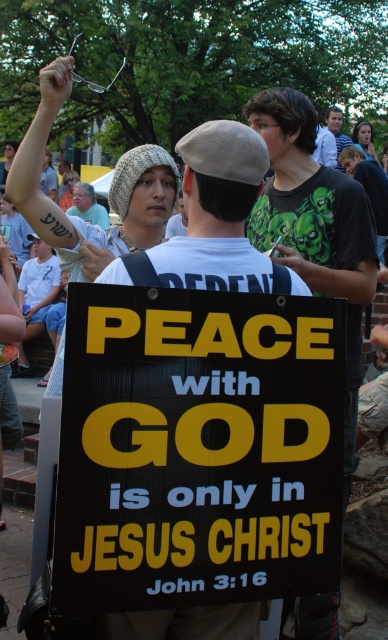
Can you confirm if beige knit hat at upper center is positioned above green t-shirt at center?

No.

Is beige knit hat at upper center wider than green t-shirt at center?

Yes, beige knit hat at upper center is wider than green t-shirt at center.

Which is in front, point (93, 220) or point (334, 132)?

Point (93, 220) is in front.

Image resolution: width=388 pixels, height=640 pixels. I want to click on beige knit hat at upper center, so click(x=88, y=205).

Can you confirm if yellow/black cardboard sign at center is thinner than beige knit hat at upper center?

Yes.

Is yellow/black cardboard sign at center below beige knit hat at upper center?

Indeed, yellow/black cardboard sign at center is positioned under beige knit hat at upper center.

Which is in front, point (154, 348) or point (83, 212)?

Point (154, 348) is more forward.

Where is `yellow/black cardboard sign at center`? yellow/black cardboard sign at center is located at coordinates (197, 449).

Between yellow/black cardboard sign at center and green t-shirt at center, which one appears on the left side from the viewer's perspective?

yellow/black cardboard sign at center

Between yellow/black cardboard sign at center and green t-shirt at center, which one has more height?

With more height is green t-shirt at center.

The width and height of the screenshot is (388, 640). I want to click on yellow/black cardboard sign at center, so click(197, 449).

You are a GUI agent. You are given a task and a screenshot of the screen. Output one action in this format:
    pyautogui.click(x=<x>, y=<y>)
    Task: Click on the yellow/black cardboard sign at center
    This screenshot has height=640, width=388.
    Given the screenshot: What is the action you would take?
    pyautogui.click(x=197, y=449)